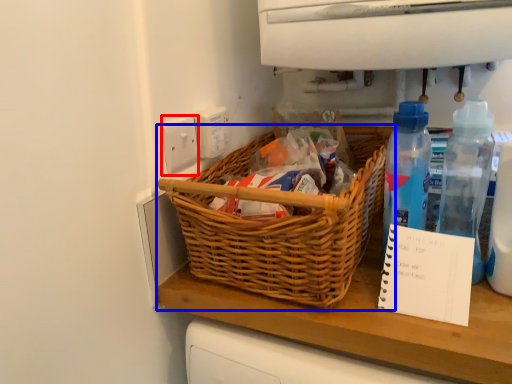
Question: Which object appears farthest to the camera in this image, electric outlet (highlighted by a red box) or picnic basket (highlighted by a blue box)?

Choices:
 (A) electric outlet
 (B) picnic basket

Answer: (A)